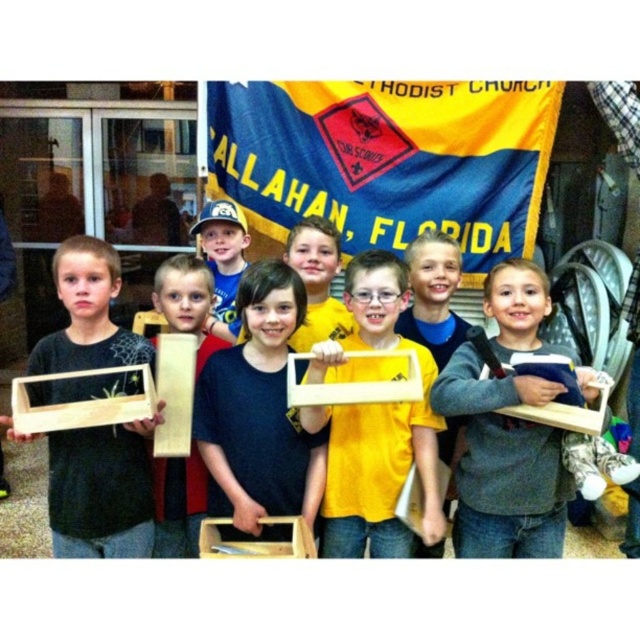
You are a photographer taking a picture of the matte wood box at left and the light brown wood at center. Which object should you focus on first to ensure both are in sharp focus?

You should focus on the matte wood box at left first because it is closer to the viewer than the light brown wood at center. By focusing on the closer object, the depth of field may extend to include the farther object as well, ensuring both are in sharp focus.

In the scene shown: Looking at the scene where children are displaying their handmade items in front of the Allahan, Florida building, can you determine which object is positioned to the right of the other between the matte wood frame at center and the matte black cap at center?

The matte wood frame at center is positioned to the right of the matte black cap at center.

You are a photographer trying to capture a clear shot of both the matte black shirt at center and the matte black cap at center. Since they are both at the center, which one should you focus on to ensure the taller object is in focus?

The matte black shirt at center is taller than the matte black cap at center, so you should focus on the matte black shirt at center to ensure the taller object is in focus.